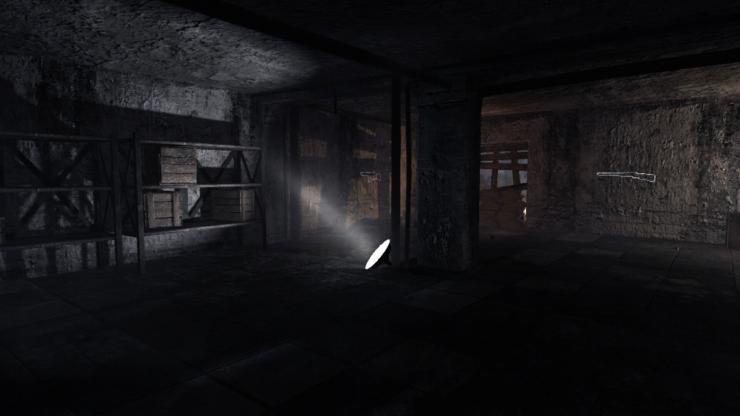
This screenshot has height=416, width=740. Find the location of `box`. box is located at coordinates (181, 158).